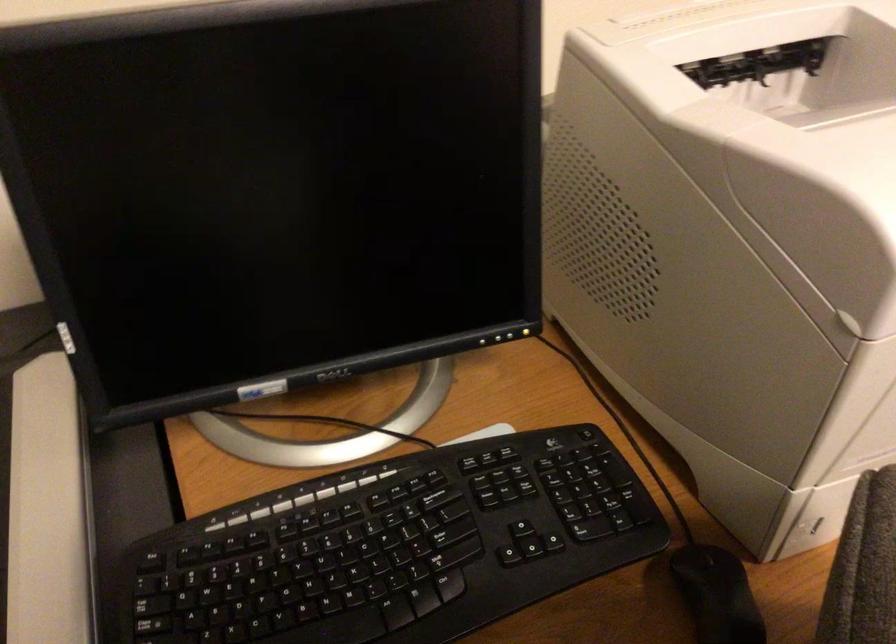
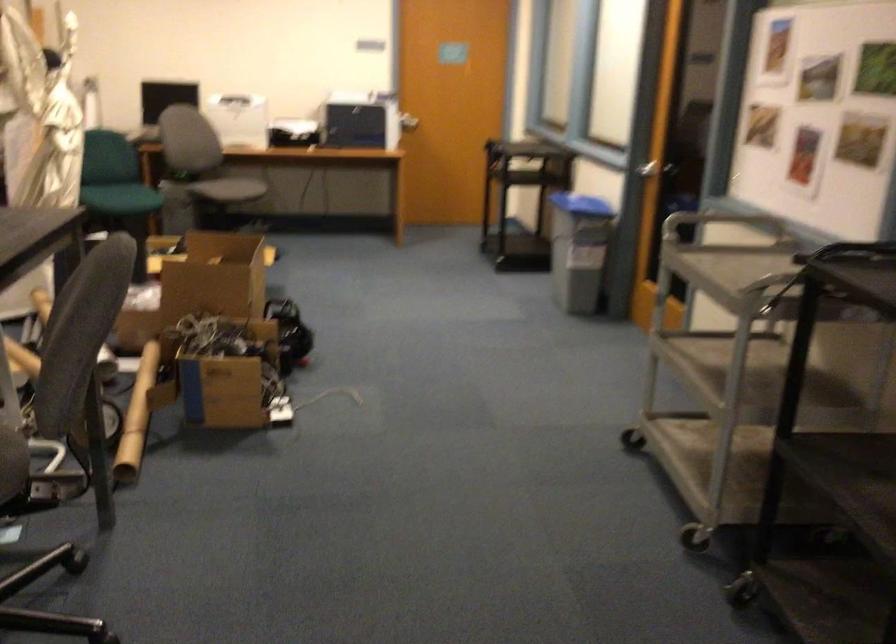
Question: I am providing you with two images of the same scene from different viewpoints. Please identify which objects are invisible in image2.

Choices:
 (A) monitor control button
 (B) bed post hole
 (C) silver door handle
 (D) cardboard box

Answer: (A)